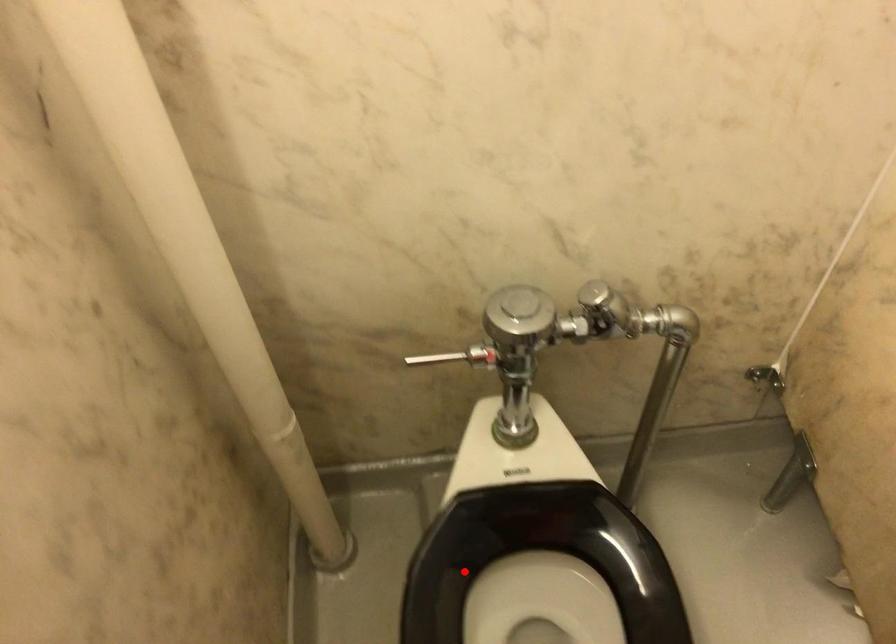
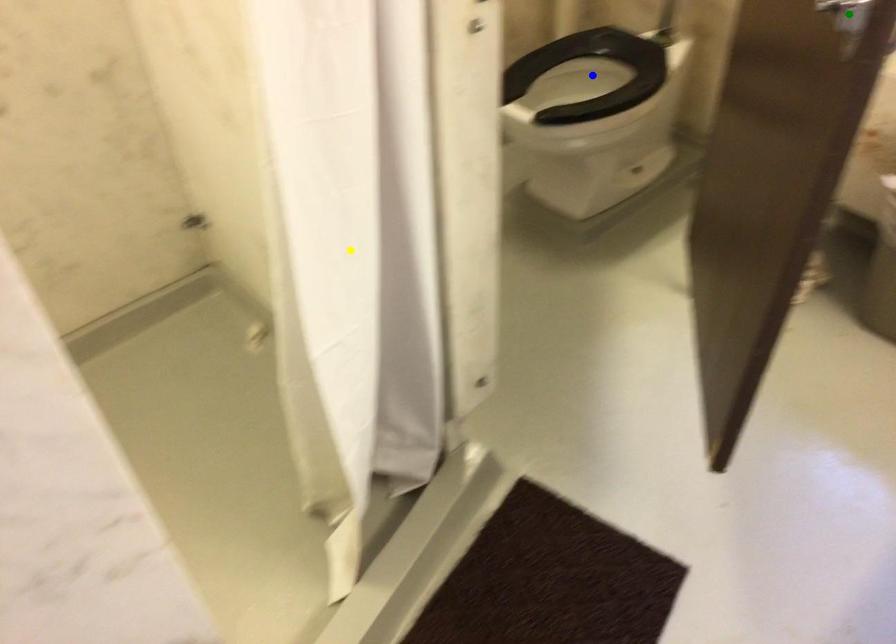
Question: I am providing you with two images of the same scene from different viewpoints. A red point is marked on the first image. You are given multiple points on the second image. Can you choose the point in image 2 that corresponds to the point in image 1?

Choices:
 (A) yellow point
 (B) green point
 (C) blue point

Answer: (C)